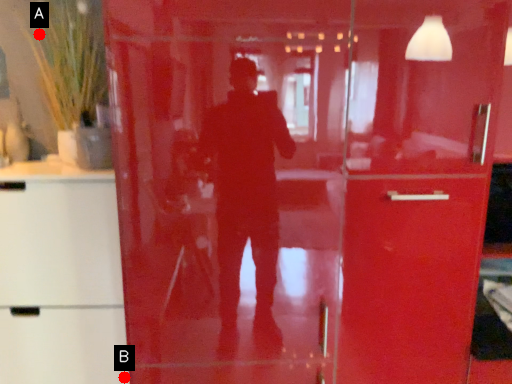
Question: Two points are circled on the image, labeled by A and B beside each circle. Which point appears farthest from the camera in this image?

Choices:
 (A) A is further
 (B) B is further

Answer: (A)